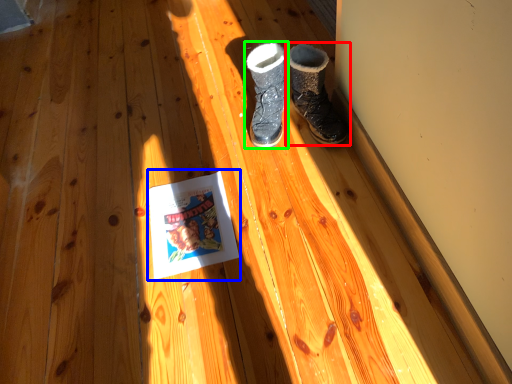
Question: Estimate the real-world distances between objects in this image. Which object is closer to footwear (highlighted by a red box), paperback book (highlighted by a blue box) or footwear (highlighted by a green box)?

Choices:
 (A) paperback book
 (B) footwear

Answer: (B)